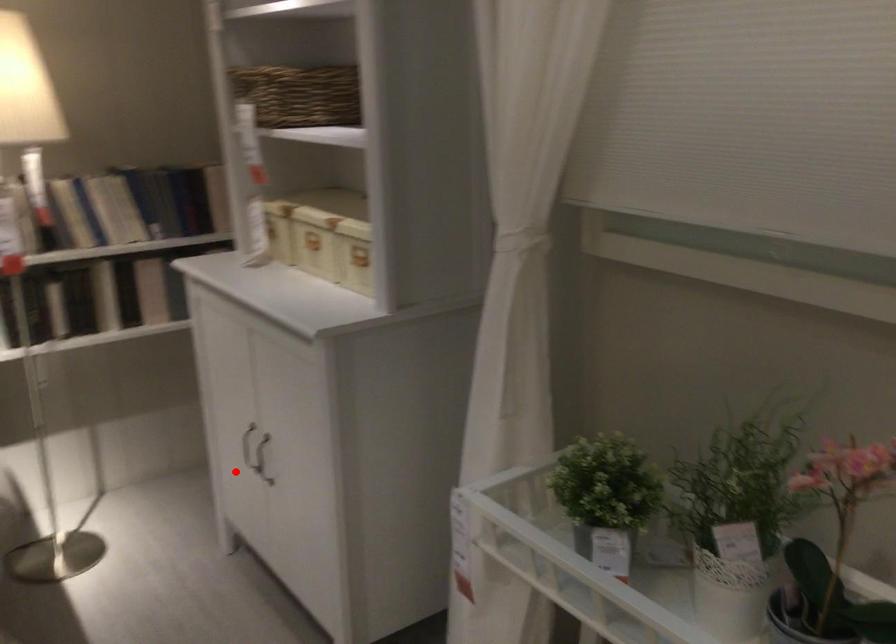
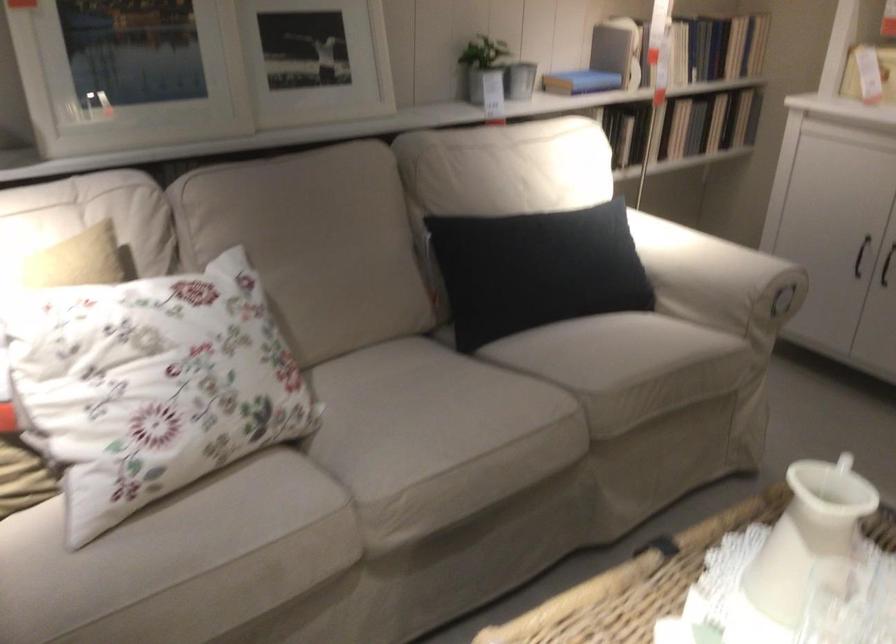
Where in the second image is the point corresponding to the highlighted location from the first image?

(886, 265)